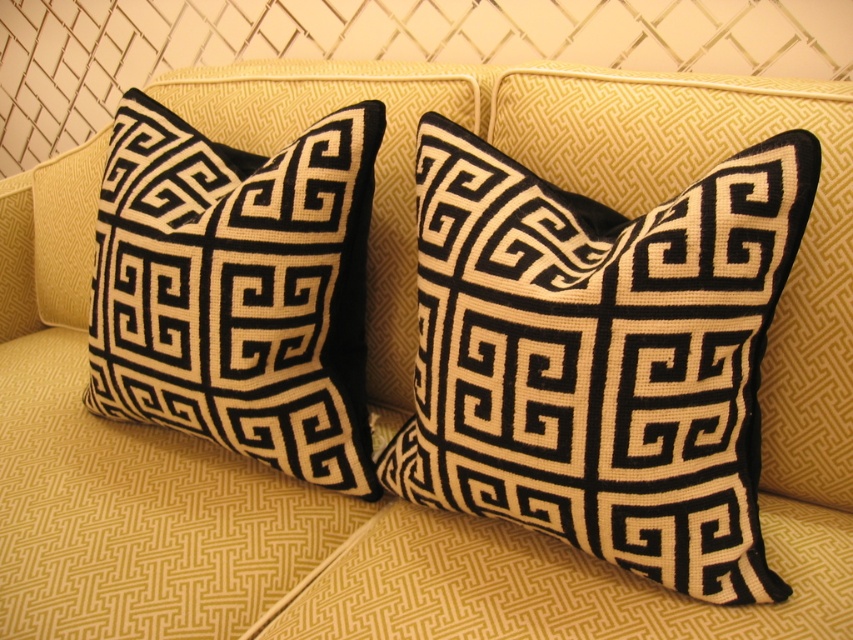
This screenshot has width=853, height=640. Describe the element at coordinates (601, 356) in the screenshot. I see `black velvet pillow at center` at that location.

At what (x,y) coordinates should I click in order to perform the action: click on black velvet pillow at center. Please return your answer as a coordinate pair (x, y). The height and width of the screenshot is (640, 853). Looking at the image, I should click on (601, 356).

Which is in front, point (436, 422) or point (318, 410)?

Point (436, 422) is more forward.

This screenshot has height=640, width=853. Find the location of `black velvet pillow at center`. black velvet pillow at center is located at coordinates (601, 356).